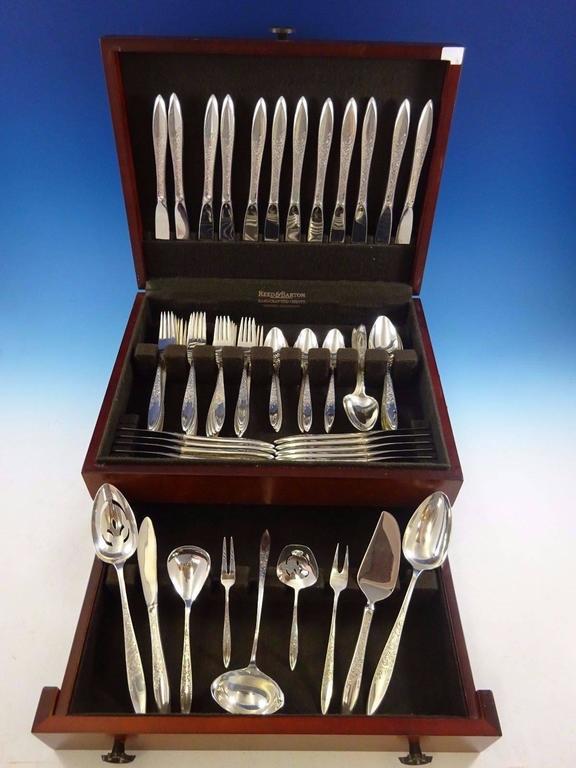
What are the coordinates of `spoon` in the screenshot? It's located at (115, 528), (185, 563), (288, 568), (248, 710), (439, 543), (386, 333), (365, 399), (335, 339), (306, 339), (272, 339).